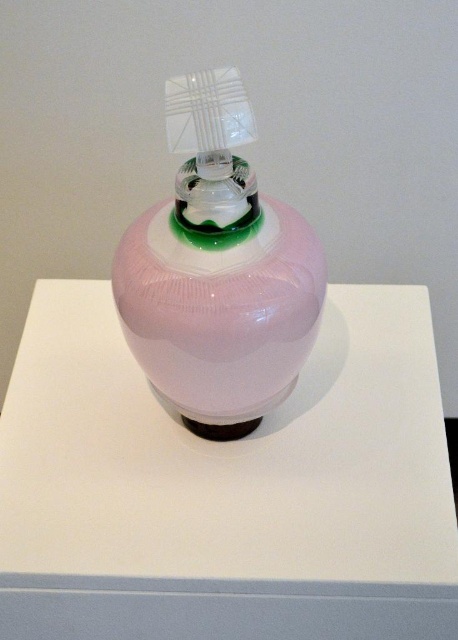
Consider the image. Which is above, glossy white table at center or pink glossy bottle at center?

pink glossy bottle at center is above.

Is glossy white table at center smaller than pink glossy bottle at center?

Incorrect, glossy white table at center is not smaller in size than pink glossy bottle at center.

Between point (77, 536) and point (214, 419), which one is positioned behind?

The point (214, 419) is behind.

You are a GUI agent. You are given a task and a screenshot of the screen. Output one action in this format:
    pyautogui.click(x=<x>, y=<y>)
    Task: Click on the glossy white table at center
    
    Given the screenshot: What is the action you would take?
    pyautogui.click(x=227, y=488)